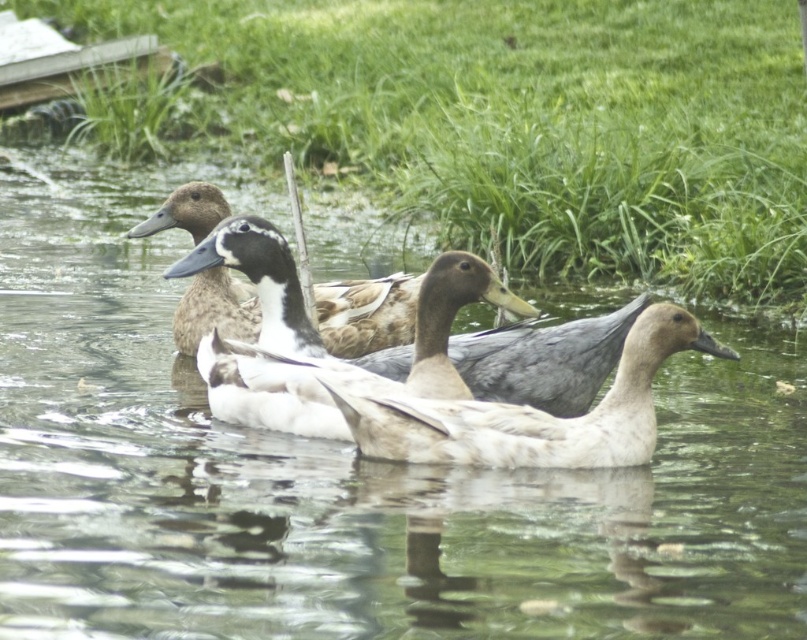
Which is in front, point (458, 284) or point (391, 400)?

Point (391, 400) is more forward.

How distant is white matte duck at center from white feathered duck at center?

They are 14.47 inches apart.

You are a GUI agent. You are given a task and a screenshot of the screen. Output one action in this format:
    pyautogui.click(x=<x>, y=<y>)
    Task: Click on the white matte duck at center
    Image resolution: width=807 pixels, height=640 pixels.
    Given the screenshot: What is the action you would take?
    pyautogui.click(x=318, y=336)

Find the location of a particular element. white matte duck at center is located at coordinates (318, 336).

Does point (509, 99) come farther from viewer compared to point (617, 369)?

Yes, point (509, 99) is farther from viewer.

Does green grass at center have a larger size compared to white feathered duck at center?

Yes, green grass at center is bigger than white feathered duck at center.

Between point (341, 106) and point (536, 422), which one is positioned behind?

The point (341, 106) is behind.

The image size is (807, 640). Find the location of `green grass at center`. green grass at center is located at coordinates (527, 122).

Can you confirm if green grass at center is positioned above white matte duck at center?

Yes, green grass at center is above white matte duck at center.

Looking at this image, which of these two, green grass at center or white matte duck at center, stands taller?

green grass at center

This screenshot has width=807, height=640. What do you see at coordinates (527, 122) in the screenshot?
I see `green grass at center` at bounding box center [527, 122].

The image size is (807, 640). In order to click on green grass at center in this screenshot , I will do `click(527, 122)`.